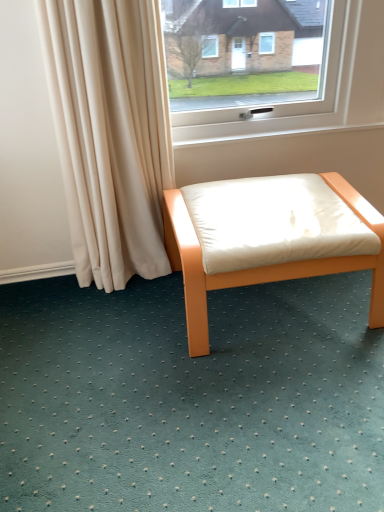
The height and width of the screenshot is (512, 384). I want to click on free space in front of matte orange stool at center, so click(266, 408).